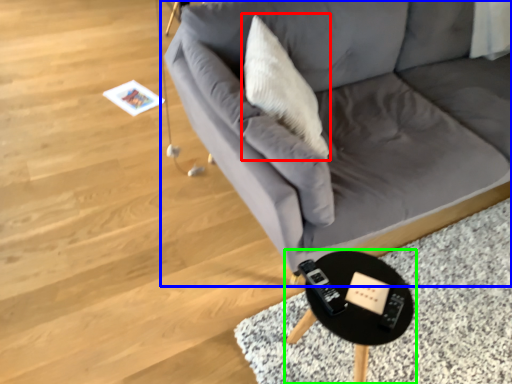
Question: Considering the real-world distances, which object is closest to throw pillow (highlighted by a red box)? studio couch (highlighted by a blue box) or table (highlighted by a green box).

Choices:
 (A) studio couch
 (B) table

Answer: (A)